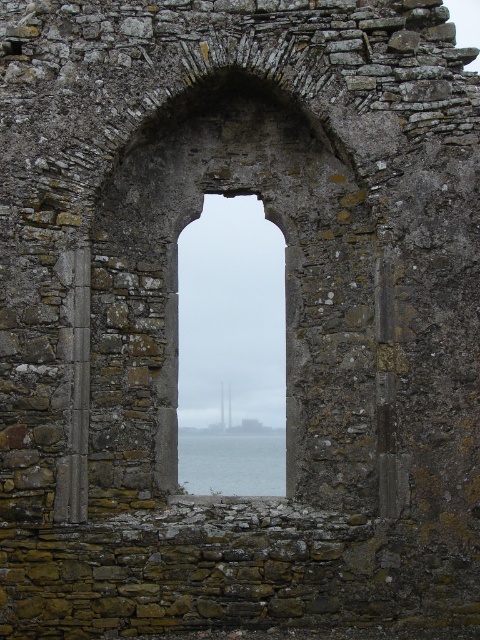
You are an architect examining the ancient stone archway. You notice two transparent features at the center of the image. Which one is narrower between the transparent glass window at center and the transparent glass water at center?

The transparent glass window at center has a lesser width compared to the transparent glass water at center, so the transparent glass window at center is narrower.